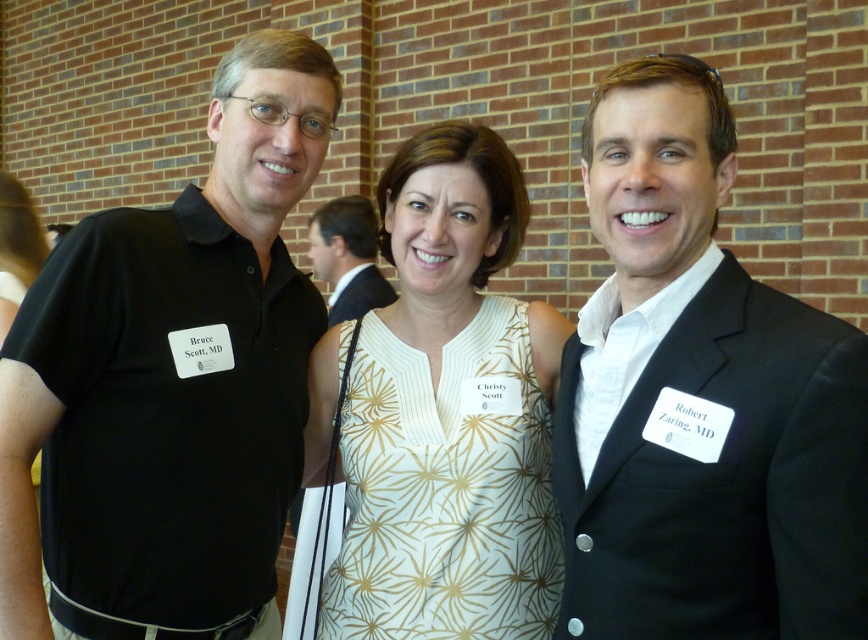
You are a photographer standing 2 meters away from the black suit at right. You want to take a group photo of all three people. Can you fit them all in your camera frame if your camera has a 60cm width field of view?

The three people are 1.10 meters apart. Since the camera has a 60cm width field of view, which is 0.6 meters, and the distance between the people is wider than that, they cannot all fit in the frame.

You are a photographer at a professional event and want to capture a group photo of the black matte shirt at left and the person in the sleeveless white dress with gold floral pattern in the center. The minimum distance required for your camera to focus properly is 4 feet. Can you take the photo without moving them?

The black matte shirt at left and the person in the sleeveless white dress with gold floral pattern in the center are 4.16 feet apart, so yes, you can take the photo without moving them because the distance is more than the required 4 feet for proper focus.